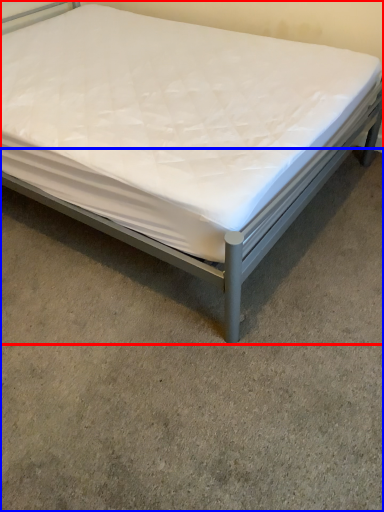
Question: Among these objects, which one is farthest to the camera, bed (highlighted by a red box) or concrete (highlighted by a blue box)?

Choices:
 (A) bed
 (B) concrete

Answer: (A)